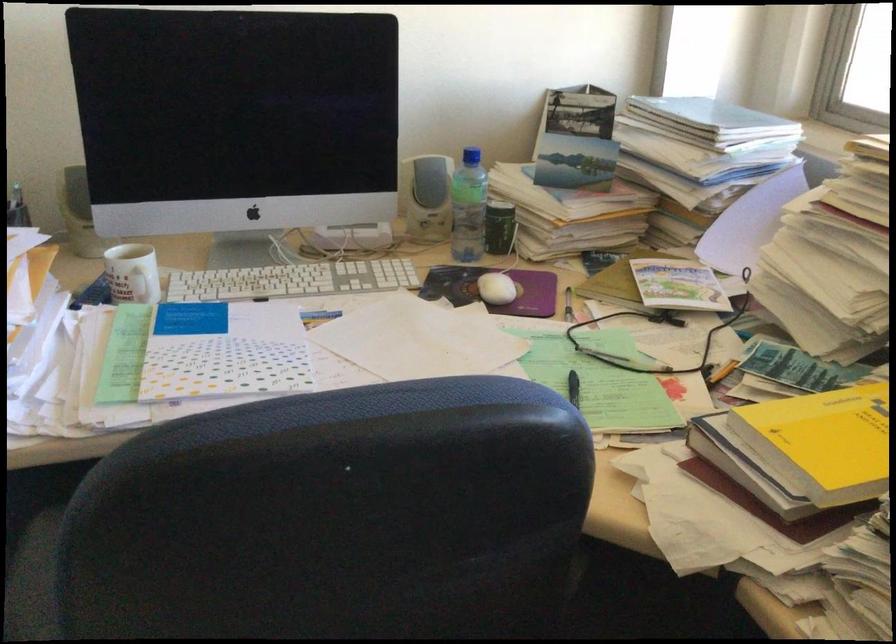
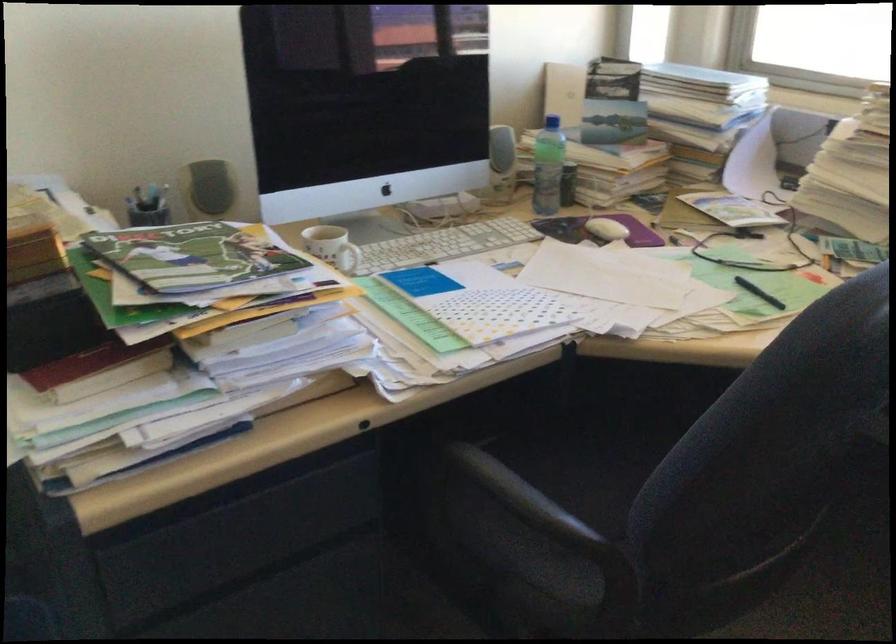
The point at (487, 290) is marked in the first image. Where is the corresponding point in the second image?

(606, 229)